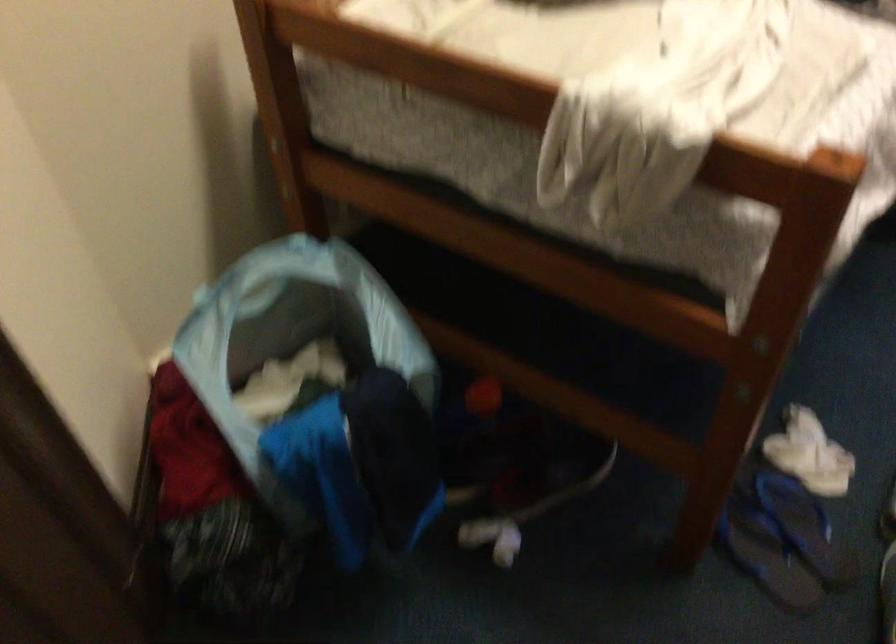
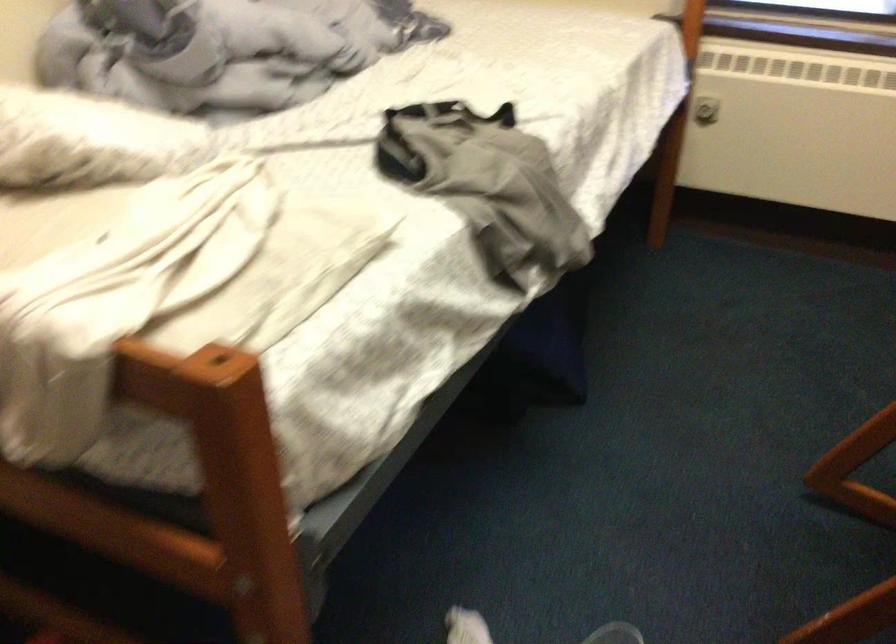
Question: What movement of the cameraman would produce the second image?

Choices:
 (A) Left
 (B) Right
 (C) Forward
 (D) Backward

Answer: (B)